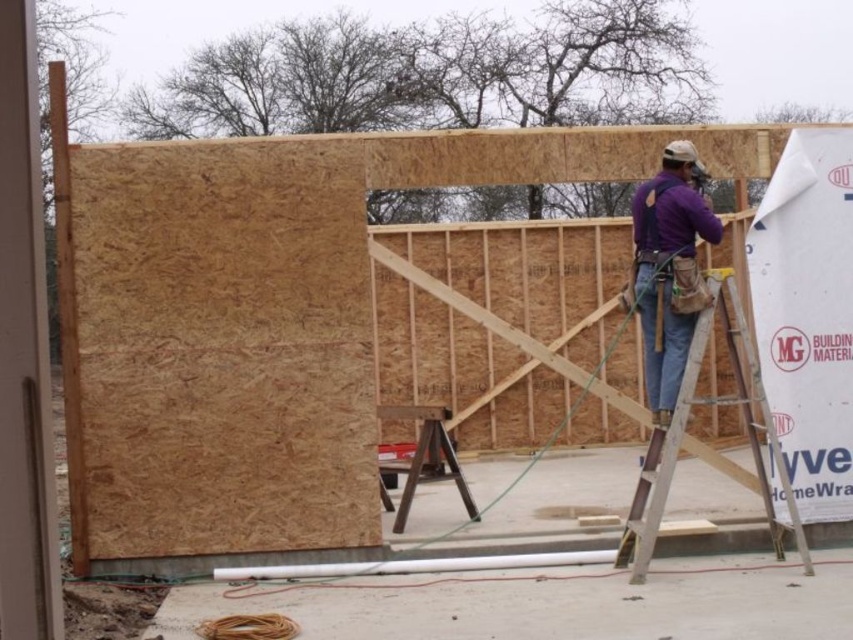
Is point (671, 260) behind point (751, 444)?

No, (671, 260) is in front of (751, 444).

This screenshot has width=853, height=640. In order to click on purple cotton shirt at center in this screenshot , I will do point(669,268).

Which is in front, point (691, 308) or point (651, 506)?

Point (651, 506)

Locate an element on the screen. purple cotton shirt at center is located at coordinates (669, 268).